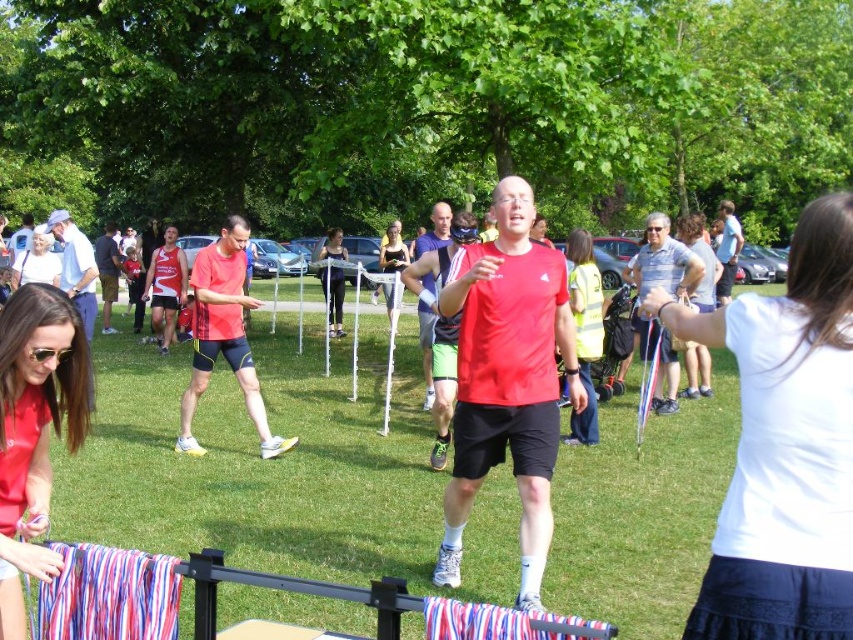
You are standing at the point with coordinates point (390, 250) and want to walk towards the point (751, 406). Which direction should you move relative to your current position?

Since point (751, 406) is closer to the camera than point (390, 250), you should move forward towards it.

From the picture: You are a photographer at the event and want to capture a photo that includes both the matte red shirt at lower left and the black mesh tank top at center. Which object should be placed lower in the frame to ensure both are visible?

The matte red shirt at lower left should be placed lower in the frame because it is positioned under the black mesh tank top at center, so placing it lower will ensure both are visible.

You are a photographer at the event and need to capture a clear photo of both the matte red shirt at lower left and the black mesh tank top at center. Which of the two should you focus on first to ensure they are both in sharp focus?

The matte red shirt at lower left has a larger size compared to the black mesh tank top at center. Since it is bigger, you should focus on the matte red shirt at lower left first to ensure both are in sharp focus.